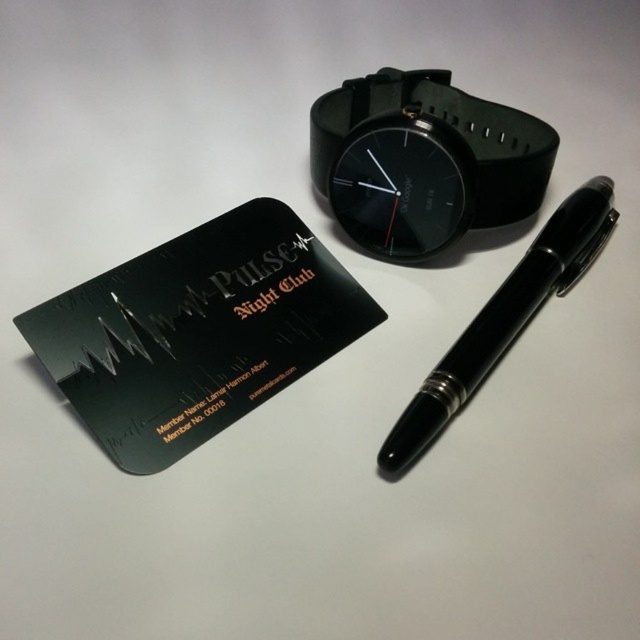
Is black matte business card at lower left taller than black rubber watch at upper center?

Yes.

Does black matte business card at lower left have a larger size compared to black rubber watch at upper center?

Yes.

Between point (33, 352) and point (392, 115), which one is positioned in front?

Positioned in front is point (33, 352).

The width and height of the screenshot is (640, 640). In order to click on black matte business card at lower left in this screenshot , I will do `click(196, 332)`.

Between black rubber watch at upper center and black glossy pen at center, which one has more height?

black glossy pen at center

Can you confirm if black rubber watch at upper center is positioned to the right of black glossy pen at center?

No, black rubber watch at upper center is not to the right of black glossy pen at center.

The image size is (640, 640). I want to click on black rubber watch at upper center, so click(422, 161).

Looking at this image, does black matte business card at lower left appear on the right side of black glossy pen at center?

No, black matte business card at lower left is not to the right of black glossy pen at center.

Which is in front, point (145, 292) or point (420, 449)?

Positioned in front is point (420, 449).

The image size is (640, 640). What are the coordinates of `black matte business card at lower left` in the screenshot? It's located at (196, 332).

Find the location of a particular element. This screenshot has width=640, height=640. black matte business card at lower left is located at coordinates (196, 332).